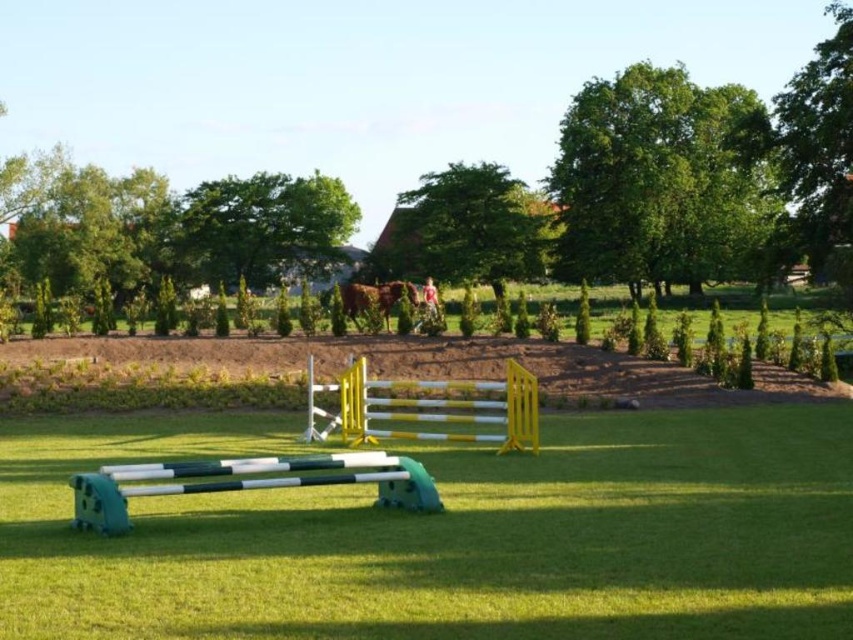
Which of these two, green rubber hurdle at center or brown glossy horse at center, stands shorter?

Standing shorter between the two is green rubber hurdle at center.

Is green rubber hurdle at center positioned behind brown glossy horse at center?

No, green rubber hurdle at center is closer to the viewer.

Who is more forward, (138,474) or (358,300)?

Positioned in front is point (138,474).

Where is `green rubber hurdle at center`? This screenshot has width=853, height=640. green rubber hurdle at center is located at coordinates (248, 483).

The image size is (853, 640). Describe the element at coordinates (427, 406) in the screenshot. I see `yellow plastic hurdle at center` at that location.

Between yellow plastic hurdle at center and brown glossy horse at center, which one is positioned higher?

brown glossy horse at center

Is point (350, 412) behind point (403, 289)?

No, it is not.

Identify the location of yellow plastic hurdle at center. (427, 406).

Does point (527, 372) come behind point (138, 480)?

Yes.

Image resolution: width=853 pixels, height=640 pixels. What are the coordinates of `yellow plastic hurdle at center` in the screenshot? It's located at (427, 406).